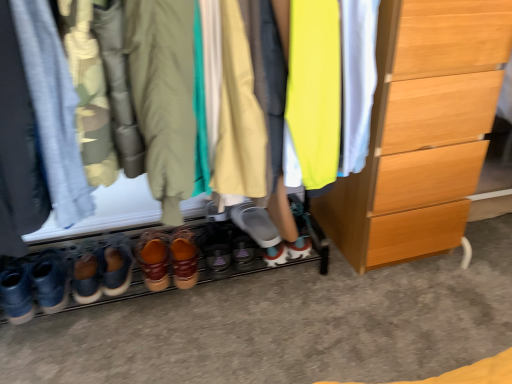
Image resolution: width=512 pixels, height=384 pixels. I want to click on free space to the right of leather boots at center, the 3th footwear when ordered from right to left, so [x=371, y=303].